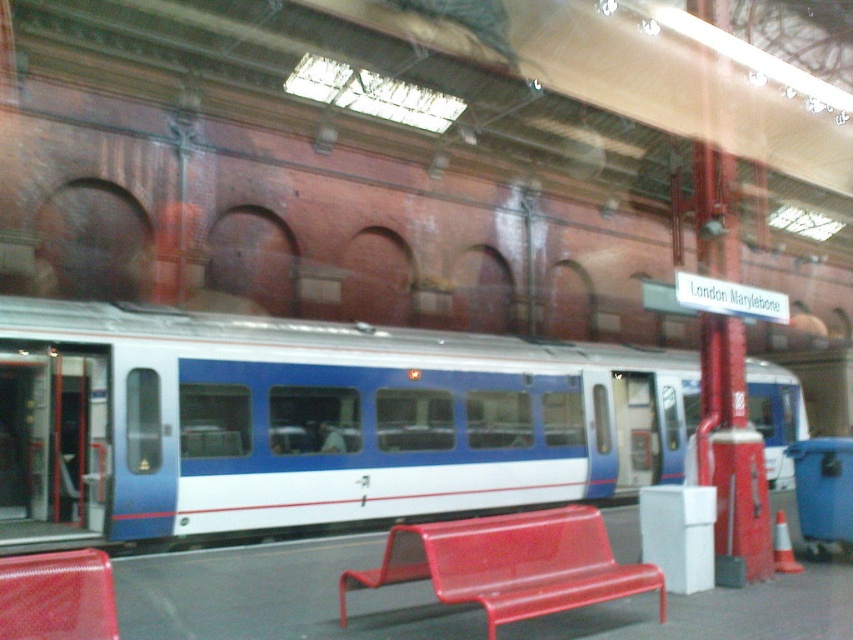
Is blue/white plastic train at center shorter than rubberized red bench at lower left?

No.

Is point (753, 362) positioned behind point (1, 588)?

That is True.

You are a GUI agent. You are given a task and a screenshot of the screen. Output one action in this format:
    pyautogui.click(x=<x>, y=<y>)
    Task: Click on the blue/white plastic train at center
    
    Given the screenshot: What is the action you would take?
    pyautogui.click(x=311, y=420)

You are a GUI agent. You are given a task and a screenshot of the screen. Output one action in this format:
    pyautogui.click(x=<x>, y=<y>)
    Task: Click on the blue/white plastic train at center
    
    Given the screenshot: What is the action you would take?
    pyautogui.click(x=311, y=420)

Between metallic red bench at lower center and rubberized red bench at lower left, which one has more height?

rubberized red bench at lower left

Which is in front, point (589, 602) or point (100, 621)?

Point (100, 621) is in front.

Who is more forward, (584,554) or (25,595)?

Point (25,595) is more forward.

Find the location of a particular element. The image size is (853, 640). metallic red bench at lower center is located at coordinates (509, 564).

Can you confirm if blue/white plastic train at center is positioned to the left of metallic red bench at lower center?

In fact, blue/white plastic train at center is to the right of metallic red bench at lower center.

Identify the location of blue/white plastic train at center. The image size is (853, 640). (311, 420).